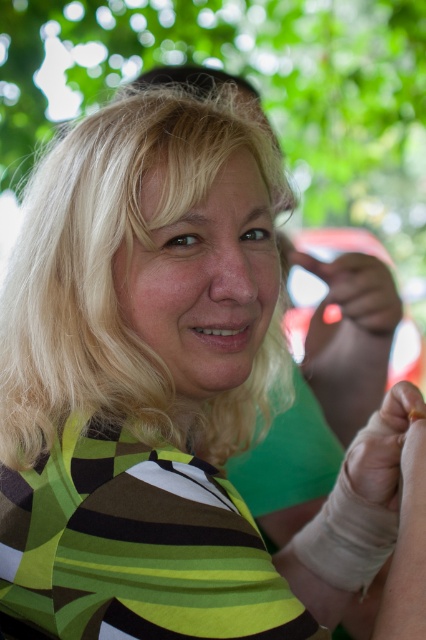
Question: Which of the following is the farthest from the observer?

Choices:
 (A) (94, 372)
 (B) (356, 401)
 (C) (360, 312)

Answer: (B)

Question: Can you confirm if blonde hair at center is bigger than white smooth bandage at lower right?

Choices:
 (A) no
 (B) yes

Answer: (B)

Question: Which of the following is the farthest from the observer?

Choices:
 (A) white smooth bandage at lower right
 (B) smooth white glove at center
 (C) smooth yellowish skin at center
 (D) green leafy tree at upper center

Answer: (D)

Question: Does blonde hair at center have a greater width compared to white leather glove at upper right?

Choices:
 (A) no
 (B) yes

Answer: (B)

Question: Which object is positioned closest to the smooth white glove at center?

Choices:
 (A) green leafy tree at upper center
 (B) white smooth bandage at lower right
 (C) smooth yellowish skin at center
 (D) white leather glove at upper right

Answer: (D)

Question: Can you confirm if blonde hair at center is positioned to the right of green leafy tree at upper center?

Choices:
 (A) yes
 (B) no

Answer: (B)